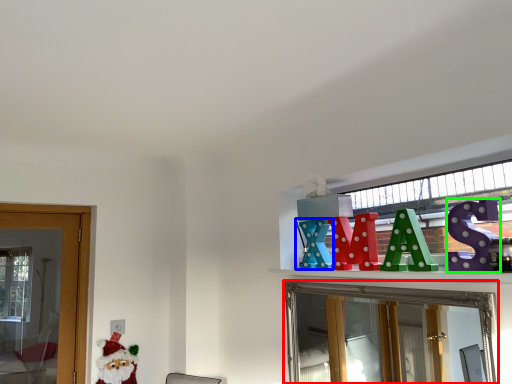
Question: Based on their relative distances, which object is nearer to mirror (highlighted by a red box)? Choose from toy (highlighted by a blue box) and toy (highlighted by a green box).

Choices:
 (A) toy
 (B) toy

Answer: (A)